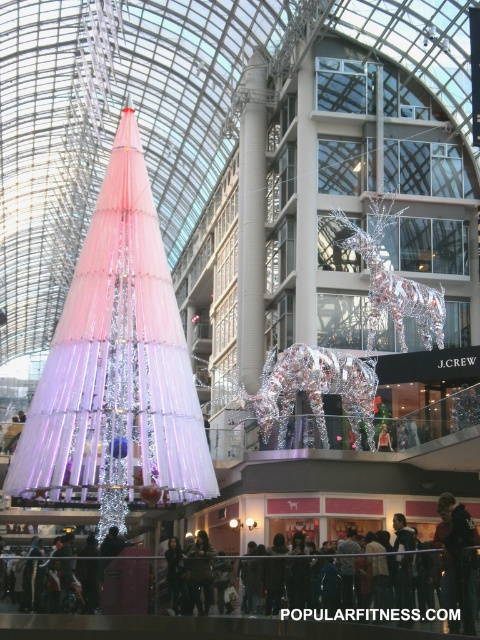
Is point (267, 388) positioned in front of point (371, 282)?

Yes, it is.

Who is taller, shiny metallic reindeer at center or silver metallic reindeer at center?

silver metallic reindeer at center

Who is more forward, (x=331, y=356) or (x=372, y=253)?

Point (x=331, y=356)

At what (x,y) coordinates should I click in order to perform the action: click on shiny metallic reindeer at center. Please return your answer as a coordinate pair (x, y). This screenshot has height=640, width=480. Looking at the image, I should click on (312, 388).